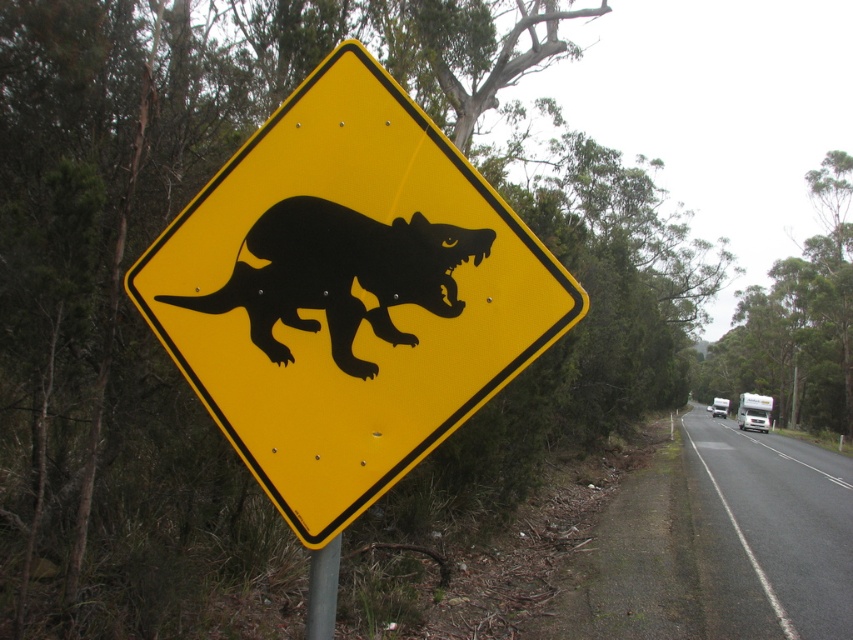
Question: Estimate the real-world distances between objects in this image. Which object is farther from the black glossy ferret at center?

Choices:
 (A) yellow metal sign at center
 (B) metallic gray pole at lower center

Answer: (B)

Question: Which of these objects is positioned closest to the yellow metal sign at center?

Choices:
 (A) metallic gray pole at lower center
 (B) black glossy ferret at center

Answer: (B)

Question: Among these objects, which one is nearest to the camera?

Choices:
 (A) metallic gray pole at lower center
 (B) yellow metal sign at center
 (C) black glossy ferret at center

Answer: (B)

Question: In this image, where is yellow metal sign at center located relative to black glossy ferret at center?

Choices:
 (A) above
 (B) below

Answer: (B)

Question: Is yellow metal sign at center below black glossy ferret at center?

Choices:
 (A) yes
 (B) no

Answer: (A)

Question: Does black glossy ferret at center appear under metallic gray pole at lower center?

Choices:
 (A) no
 (B) yes

Answer: (A)